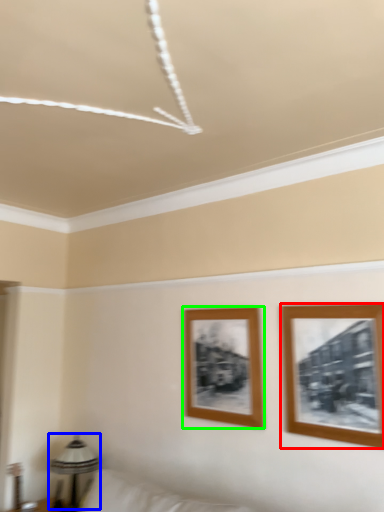
Question: Estimate the real-world distances between objects in this image. Which object is closer to picture frame (highlighted by a red box), table lamp (highlighted by a blue box) or picture frame (highlighted by a green box)?

Choices:
 (A) table lamp
 (B) picture frame

Answer: (B)